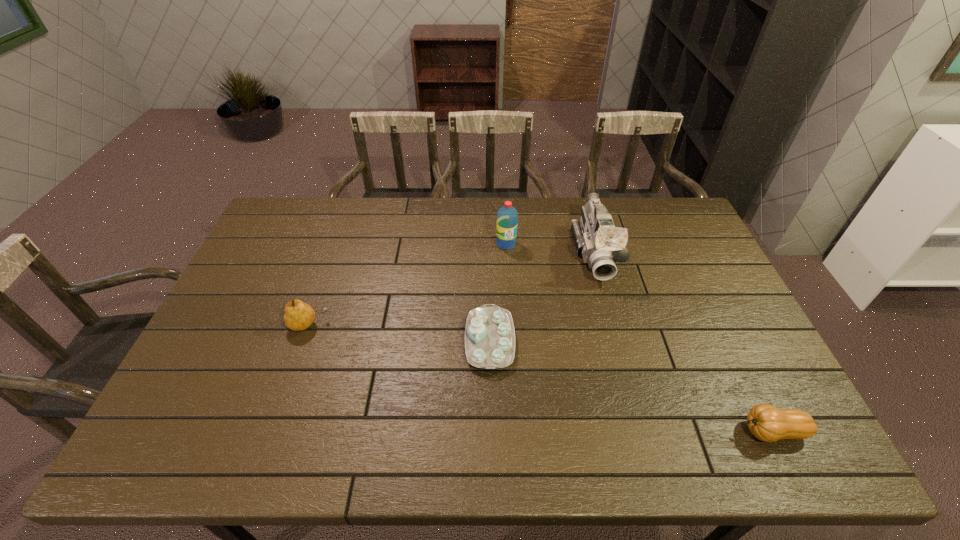
At what (x,y) coordinates should I click in order to perform the action: click on free region located on the right of the chinaware. Please return your answer as a coordinate pair (x, y). The width and height of the screenshot is (960, 540). Looking at the image, I should click on (660, 341).

Locate an element on the screen. vacant region located on the stem side of the gourd is located at coordinates (629, 431).

Where is `vacant space located on the stem side of the gourd`? This screenshot has width=960, height=540. vacant space located on the stem side of the gourd is located at coordinates (629, 431).

This screenshot has height=540, width=960. I want to click on vacant region located on the stem side of the gourd, so click(684, 431).

Identify the location of camcorder present at the far edge. Image resolution: width=960 pixels, height=540 pixels. (596, 238).

Find the location of a particular element. Image resolution: width=960 pixels, height=540 pixels. water bottle that is at the far edge is located at coordinates (507, 216).

Where is `object situated at the near edge`? object situated at the near edge is located at coordinates (766, 422).

Locate an element on the screen. Image resolution: width=960 pixels, height=540 pixels. object at the right edge is located at coordinates (766, 422).

At what (x,y) coordinates should I click in order to perform the action: click on object positioned at the near right corner. Please return your answer as a coordinate pair (x, y). Looking at the image, I should click on (766, 422).

Locate an element on the screen. The height and width of the screenshot is (540, 960). vacant area at the far edge of the desktop is located at coordinates (561, 222).